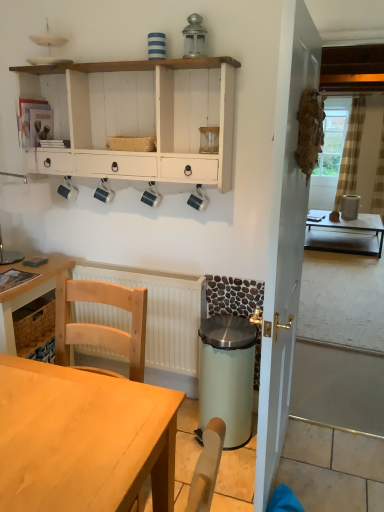
Question: Is metallic lantern at upper center positioned behind clear glass coffee cup at upper center, the first coffee cup in the right-to-left sequence?

Choices:
 (A) no
 (B) yes

Answer: (A)

Question: Is metallic lantern at upper center facing away from clear glass coffee cup at upper center, the first coffee cup in the right-to-left sequence?

Choices:
 (A) no
 (B) yes

Answer: (A)

Question: From the image's perspective, is metallic lantern at upper center located beneath clear glass coffee cup at upper center, placed as the 5th coffee cup when sorted from left to right?

Choices:
 (A) yes
 (B) no

Answer: (B)

Question: Would you say metallic lantern at upper center is outside clear glass coffee cup at upper center, the first coffee cup in the right-to-left sequence?

Choices:
 (A) no
 (B) yes

Answer: (B)

Question: Is metallic lantern at upper center in contact with clear glass coffee cup at upper center, placed as the 5th coffee cup when sorted from left to right?

Choices:
 (A) yes
 (B) no

Answer: (B)

Question: Considering the positions of metallic lantern at upper center and clear glass window screen at upper right in the image, is metallic lantern at upper center bigger or smaller than clear glass window screen at upper right?

Choices:
 (A) small
 (B) big

Answer: (A)

Question: Based on their positions, is metallic lantern at upper center located to the left or right of clear glass window screen at upper right?

Choices:
 (A) right
 (B) left

Answer: (B)

Question: From a real-world perspective, relative to clear glass window screen at upper right, is metallic lantern at upper center vertically above or below?

Choices:
 (A) below
 (B) above

Answer: (B)

Question: Choose the correct answer: Is metallic lantern at upper center inside clear glass window screen at upper right or outside it?

Choices:
 (A) outside
 (B) inside

Answer: (A)

Question: Is metallic lantern at upper center wider or thinner than wooden desk at lower left, the first desk from the front?

Choices:
 (A) thin
 (B) wide

Answer: (A)

Question: Is metallic lantern at upper center taller or shorter than wooden desk at lower left, which ranks as the 2th desk in left-to-right order?

Choices:
 (A) tall
 (B) short

Answer: (B)

Question: From the image's perspective, relative to wooden desk at lower left, the first desk from the front, is metallic lantern at upper center above or below?

Choices:
 (A) above
 (B) below

Answer: (A)

Question: Considering the positions of metallic lantern at upper center and wooden desk at lower left, the first desk from the front, in the image, is metallic lantern at upper center bigger or smaller than wooden desk at lower left, the first desk from the front,?

Choices:
 (A) big
 (B) small

Answer: (B)

Question: Would you say light green plastic trash can at lower center is inside or outside clear glass window screen at upper right?

Choices:
 (A) outside
 (B) inside

Answer: (A)

Question: Is point (208, 351) closer or farther from the camera than point (324, 165)?

Choices:
 (A) farther
 (B) closer

Answer: (B)